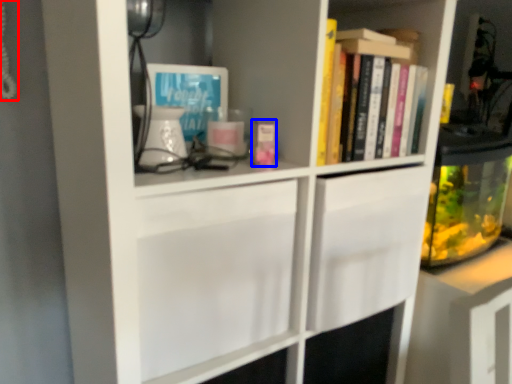
Question: Among these objects, which one is farthest to the camera, corded phone (highlighted by a red box) or book (highlighted by a blue box)?

Choices:
 (A) corded phone
 (B) book

Answer: (B)